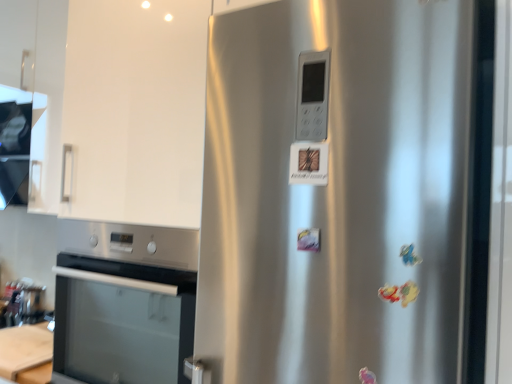
Measure the distance between point (46, 338) and camera.

They are 1.71 meters apart.

Identify the location of stainless steel oven at lower left. The image size is (512, 384). (124, 302).

What do you see at coordinates (124, 302) in the screenshot? The height and width of the screenshot is (384, 512). I see `stainless steel oven at lower left` at bounding box center [124, 302].

What do you see at coordinates (20, 141) in the screenshot?
I see `satin white exhaust hood at upper left` at bounding box center [20, 141].

I want to click on satin white exhaust hood at upper left, so click(20, 141).

In the scene shown: In order to face brushed metal toaster at lower left, should I rotate leftwards or rightwards?

Turn left approximately 27.859 degrees to face it.

The height and width of the screenshot is (384, 512). Find the location of `wooden at lower left`. wooden at lower left is located at coordinates (26, 354).

From the image's perspective, is brushed metal toaster at lower left positioned above or below satin silver fridge at center?

Based on their image positions, brushed metal toaster at lower left is located beneath satin silver fridge at center.

Does brushed metal toaster at lower left contain satin silver fridge at center?

No.

Based on the photo, which of these two, brushed metal toaster at lower left or satin silver fridge at center, stands taller?

satin silver fridge at center.

Is the surface of brushed metal toaster at lower left in direct contact with satin silver fridge at center?

No.

From the image's perspective, would you say brushed metal toaster at lower left is shown under white glossy cabinet at upper left?

Correct, brushed metal toaster at lower left appears lower than white glossy cabinet at upper left in the image.

Considering the points (42, 316) and (54, 36), which point is in front, point (42, 316) or point (54, 36)?

The point (54, 36) is in front.

The width and height of the screenshot is (512, 384). Find the location of `cabinetry that appears above the brushed metal toaster at lower left (from the image's perspective)`. cabinetry that appears above the brushed metal toaster at lower left (from the image's perspective) is located at coordinates (38, 84).

Which is correct: brushed metal toaster at lower left is inside white glossy cabinet at upper left, or outside of it?

brushed metal toaster at lower left is outside white glossy cabinet at upper left.

Is satin silver fridge at center far from satin white exhaust hood at upper left?

That's right, there is a large distance between satin silver fridge at center and satin white exhaust hood at upper left.

From a real-world perspective, is satin silver fridge at center located beneath satin white exhaust hood at upper left?

Yes, from a real-world perspective, satin silver fridge at center is below satin white exhaust hood at upper left.

Can you confirm if satin silver fridge at center is positioned to the right of satin white exhaust hood at upper left?

Yes, satin silver fridge at center is to the right of satin white exhaust hood at upper left.

Considering the sizes of objects satin silver fridge at center and satin white exhaust hood at upper left in the image provided, who is thinner, satin silver fridge at center or satin white exhaust hood at upper left?

satin white exhaust hood at upper left.

Is stainless steel oven at lower left taller than satin white exhaust hood at upper left?

Correct, stainless steel oven at lower left is much taller as satin white exhaust hood at upper left.

From a real-world perspective, is stainless steel oven at lower left above or below satin white exhaust hood at upper left?

From a real-world perspective, stainless steel oven at lower left is physically below satin white exhaust hood at upper left.

Which is more to the left, stainless steel oven at lower left or satin white exhaust hood at upper left?

Positioned to the left is satin white exhaust hood at upper left.

Considering the positions of objects stainless steel oven at lower left and satin white exhaust hood at upper left in the image provided, who is in front, stainless steel oven at lower left or satin white exhaust hood at upper left?

stainless steel oven at lower left is more forward.

From the picture: Can you confirm if wooden at lower left is shorter than satin silver fridge at center?

Correct, wooden at lower left is not as tall as satin silver fridge at center.

Is wooden at lower left situated inside satin silver fridge at center or outside?

wooden at lower left is outside satin silver fridge at center.

Considering the sizes of objects wooden at lower left and satin silver fridge at center in the image provided, who is bigger, wooden at lower left or satin silver fridge at center?

With larger size is satin silver fridge at center.

Would you say white glossy cabinet at upper left contains wooden at lower left?

Definitely not — wooden at lower left is not inside white glossy cabinet at upper left.

Is white glossy cabinet at upper left looking in the opposite direction of wooden at lower left?

No, white glossy cabinet at upper left is not facing away from wooden at lower left.

Is white glossy cabinet at upper left wider or thinner than wooden at lower left?

white glossy cabinet at upper left is thinner than wooden at lower left.

Looking at this image, is white glossy cabinet at upper left with wooden at lower left?

No, white glossy cabinet at upper left is not making contact with wooden at lower left.

How much distance is there between satin silver fridge at center and brushed metal toaster at lower left?

satin silver fridge at center is 1.67 meters from brushed metal toaster at lower left.

In the image, is satin silver fridge at center on the left side or the right side of brushed metal toaster at lower left?

From the image, it's evident that satin silver fridge at center is to the right of brushed metal toaster at lower left.

Does point (451, 221) come closer to viewer compared to point (18, 309)?

Yes.

Where is `refrigerator that appears above the brushed metal toaster at lower left (from the image's perspective)`? refrigerator that appears above the brushed metal toaster at lower left (from the image's perspective) is located at coordinates (345, 194).

Locate an element on the screen. The image size is (512, 384). appliance below the satin silver fridge at center (from the image's perspective) is located at coordinates (22, 304).

At what (x,y) coordinates should I click in order to perform the action: click on cabinetry in front of the brushed metal toaster at lower left. Please return your answer as a coordinate pair (x, y). Looking at the image, I should click on (38, 84).

When comparing their distances from brushed metal toaster at lower left, does satin white exhaust hood at upper left or wooden at lower left seem closer?

Among the two, wooden at lower left is located nearer to brushed metal toaster at lower left.

Based on their spatial positions, is wooden at lower left or stainless steel oven at lower left further from white glossy cabinet at upper left?

wooden at lower left is further to white glossy cabinet at upper left.

Looking at the image, which one is located further to satin white exhaust hood at upper left, satin silver fridge at center or stainless steel oven at lower left?

Based on the image, satin silver fridge at center appears to be further to satin white exhaust hood at upper left.

Which object lies further to the anchor point white glossy cabinet at upper left, satin white exhaust hood at upper left or stainless steel oven at lower left?

The object further to white glossy cabinet at upper left is stainless steel oven at lower left.

From the image, which object appears to be farther from satin silver fridge at center, white glossy cabinet at upper left or wooden at lower left?

white glossy cabinet at upper left lies further to satin silver fridge at center than the other object.

When comparing their distances from brushed metal toaster at lower left, does satin silver fridge at center or satin white exhaust hood at upper left seem closer?

satin white exhaust hood at upper left is positioned closer to the anchor brushed metal toaster at lower left.

From the picture: Estimate the real-world distances between objects in this image. Which object is further from stainless steel oven at lower left, brushed metal toaster at lower left or satin silver fridge at center?

Among the two, brushed metal toaster at lower left is located further to stainless steel oven at lower left.

From the image, which object appears to be farther from satin white exhaust hood at upper left, wooden at lower left or stainless steel oven at lower left?

The object further to satin white exhaust hood at upper left is stainless steel oven at lower left.

This screenshot has height=384, width=512. Find the location of `appliance between satin white exhaust hood at upper left and satin silver fridge at center in the horizontal direction`. appliance between satin white exhaust hood at upper left and satin silver fridge at center in the horizontal direction is located at coordinates (22, 304).

At what (x,y) coordinates should I click in order to perform the action: click on table between satin white exhaust hood at upper left and satin silver fridge at center from left to right. Please return your answer as a coordinate pair (x, y). Image resolution: width=512 pixels, height=384 pixels. Looking at the image, I should click on (26, 354).

You are a GUI agent. You are given a task and a screenshot of the screen. Output one action in this format:
    pyautogui.click(x=<x>, y=<y>)
    Task: Click on the table situated between brushed metal toaster at lower left and satin silver fridge at center from left to right
    
    Given the screenshot: What is the action you would take?
    pyautogui.click(x=26, y=354)

Identify the location of appliance situated between white glossy cabinet at upper left and satin silver fridge at center from left to right. The height and width of the screenshot is (384, 512). (22, 304).